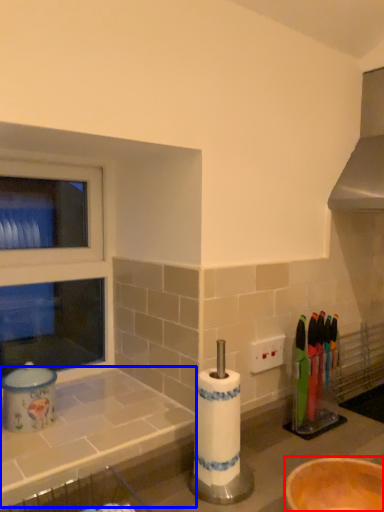
Question: Which of the following is the closest to the observer, bowl (highlighted by a red box) or counter top (highlighted by a blue box)?

Choices:
 (A) bowl
 (B) counter top

Answer: (A)